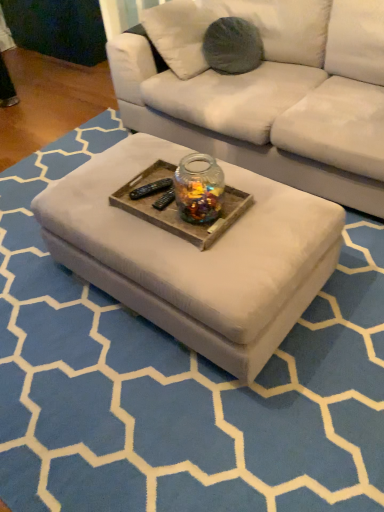
Question: Considering the relative positions of transparent glass jar at center and white fabric ottoman at center in the image provided, is transparent glass jar at center to the left or to the right of white fabric ottoman at center?

Choices:
 (A) left
 (B) right

Answer: (B)

Question: Is transparent glass jar at center inside the boundaries of white fabric ottoman at center, or outside?

Choices:
 (A) inside
 (B) outside

Answer: (B)

Question: Which object is positioned farthest from the wooden tray at center?

Choices:
 (A) transparent glass jar at center
 (B) white fabric ottoman at center

Answer: (B)

Question: Which is farther from the wooden tray at center?

Choices:
 (A) transparent glass jar at center
 (B) white fabric ottoman at center

Answer: (B)